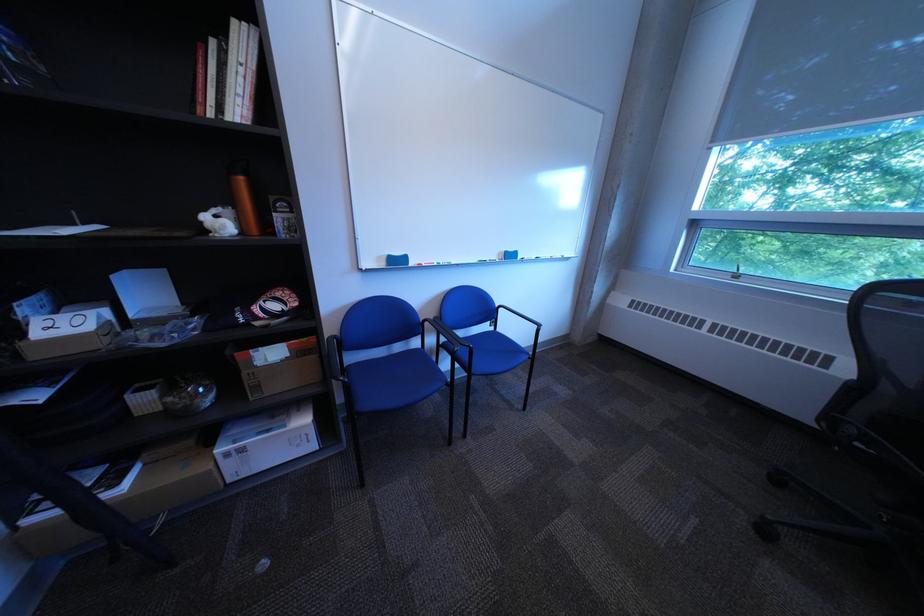
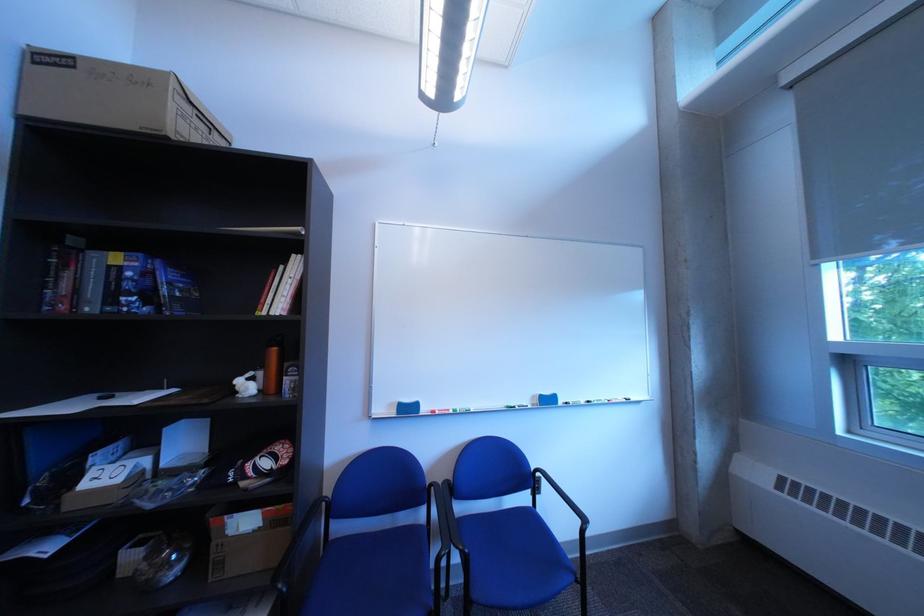
In the second image, find the point that corresponds to point (274, 387) in the first image.

(237, 565)